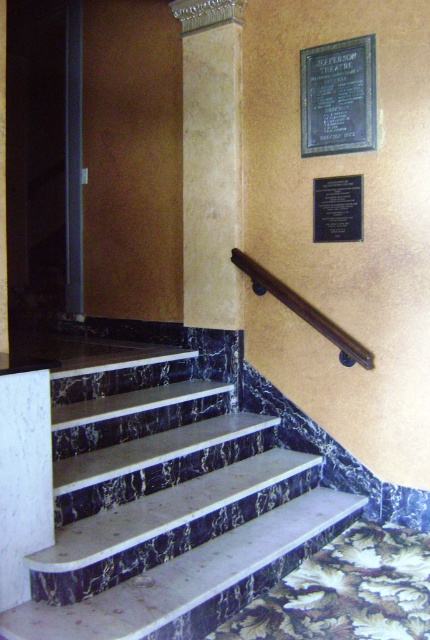
You are an interior designer assessing the staircase for safety. You need to ensure that the brown polished wood handrail at upper center is visible to users. Given that the marble stairs at center is larger in size than the handrail, could the handrail be easily overlooked due to its smaller size compared to the stairs?

The brown polished wood handrail at upper center could be easily overlooked because it is smaller in size than the marble stairs at center, which is larger. This size difference might make the handrail less noticeable to users.